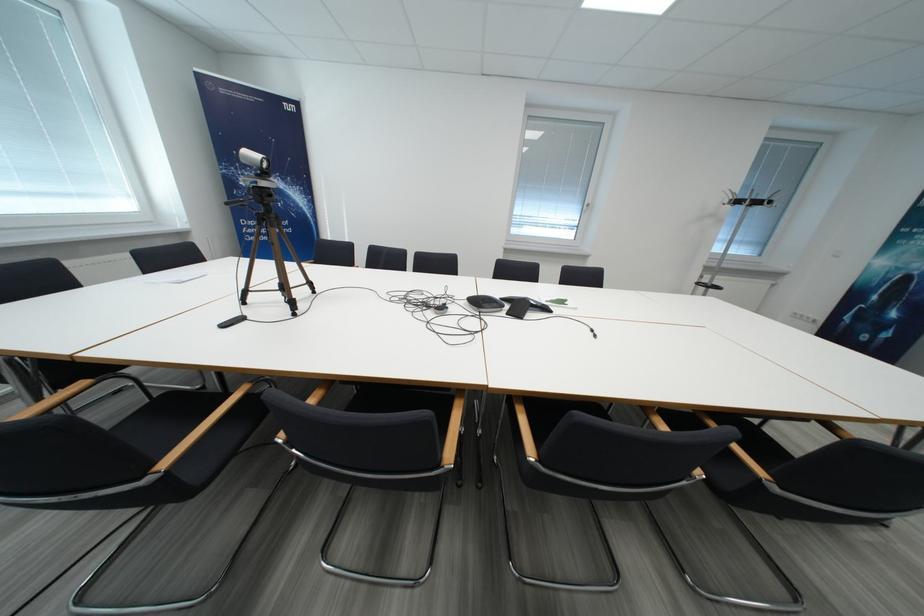
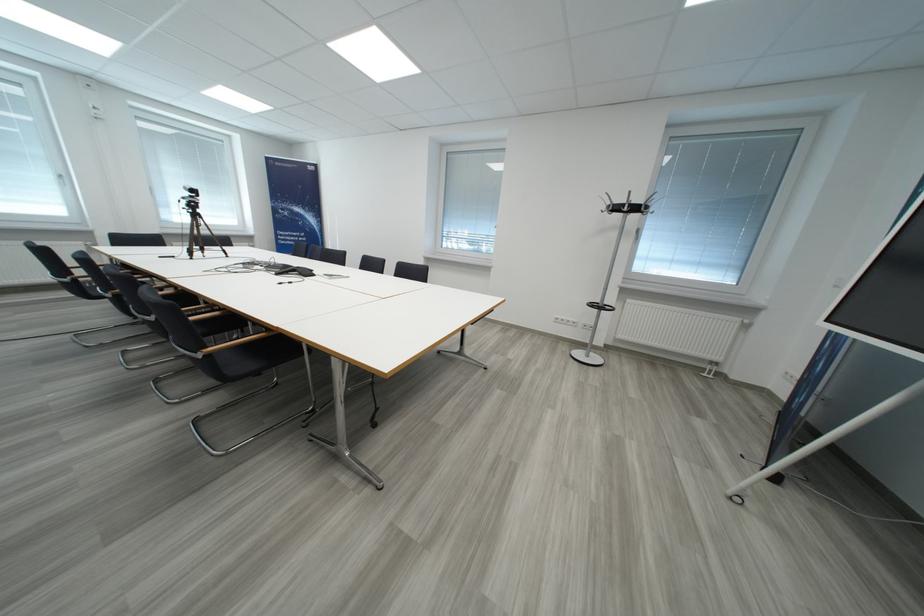
Question: In a continuous first-person perspective shot, in which direction is the camera moving?

Choices:
 (A) Left
 (B) Right
 (C) Forward
 (D) Backward

Answer: (B)